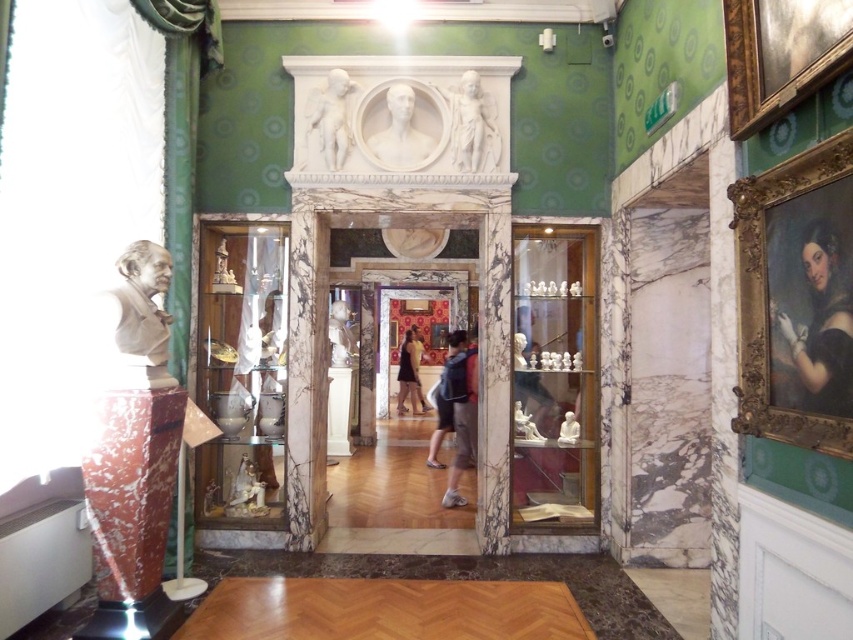
Question: Which of the following is the closest to the observer?

Choices:
 (A) denim shorts at center
 (B) white marble cherub at upper center
 (C) matte white bust at left

Answer: (C)

Question: Does matte white bust at left appear on the right side of white marble statue at center?

Choices:
 (A) no
 (B) yes

Answer: (A)

Question: Estimate the real-world distances between objects in this image. Which object is closer to the white marble cherub at upper center?

Choices:
 (A) smooth black portrait at right
 (B) white marble bust at upper center
 (C) gold-framed painting at upper right

Answer: (B)

Question: Which object is the closest to the gold ornate frame at right?

Choices:
 (A) white marble statue at upper center
 (B) denim shorts at center
 (C) white marble bust at upper center

Answer: (A)

Question: Is white marble bust at upper center positioned behind dark blue jeans at center?

Choices:
 (A) no
 (B) yes

Answer: (A)

Question: Does matte white bust at left lie behind white marble cherub at upper center?

Choices:
 (A) no
 (B) yes

Answer: (A)